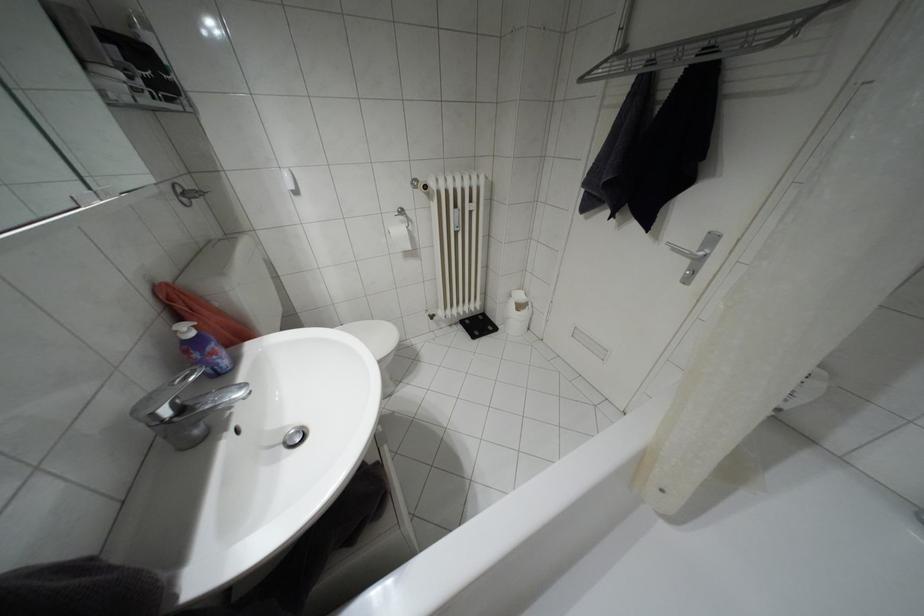
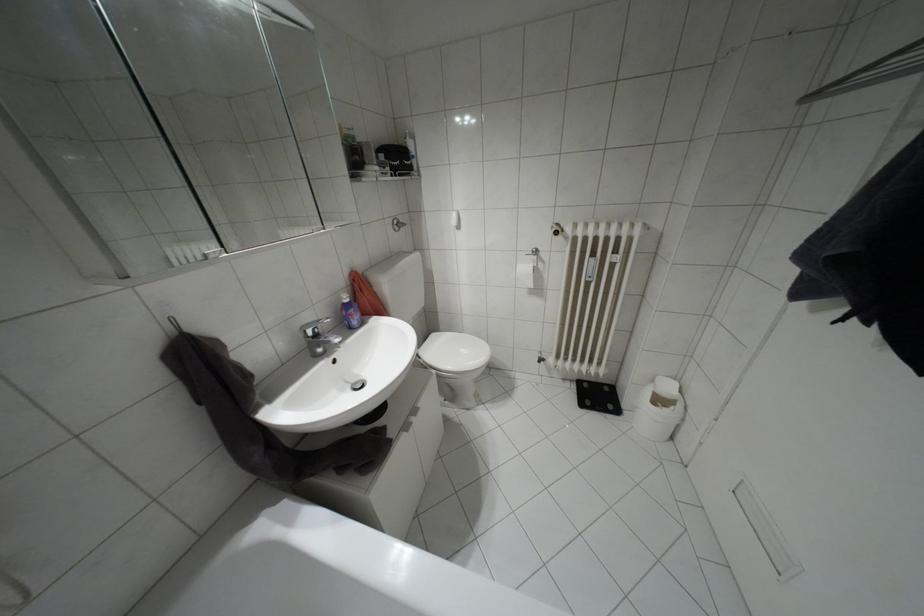
The point at (472, 336) is marked in the first image. Where is the corresponding point in the second image?

(580, 405)